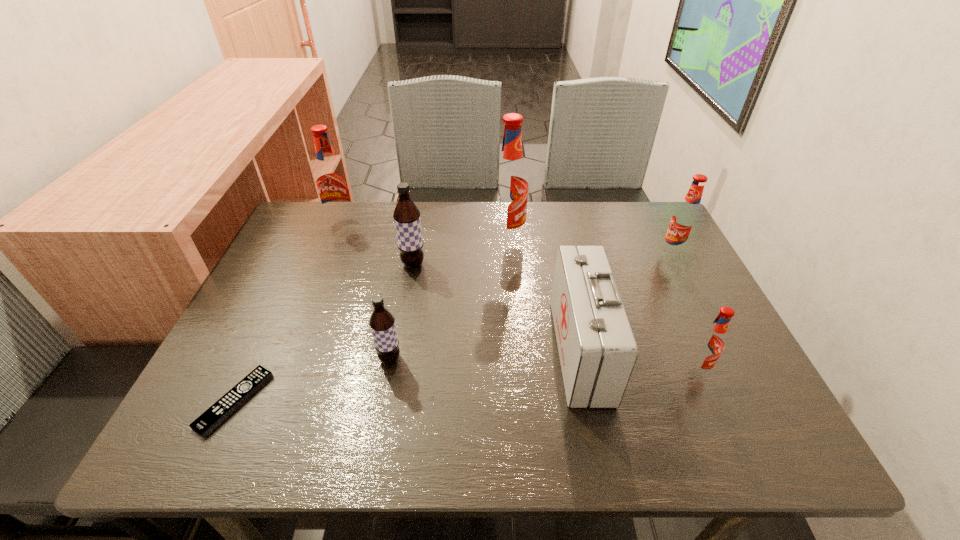
Identify the location of free point at the far edge. (540, 219).

This screenshot has height=540, width=960. Find the location of `vacant space at the near edge of the desktop`. vacant space at the near edge of the desktop is located at coordinates (372, 437).

I want to click on free space at the left edge of the desktop, so click(x=214, y=398).

The image size is (960, 540). Identify the location of vacant region at the right edge of the desktop. click(684, 357).

What are the coordinates of `vacant space at the far right corner of the desktop` in the screenshot? It's located at (623, 219).

Where is `free space between the first-aid kit and the rightmost object`? Image resolution: width=960 pixels, height=540 pixels. free space between the first-aid kit and the rightmost object is located at coordinates (627, 302).

Find the location of a particular element. The height and width of the screenshot is (540, 960). vacant area between the second smallest red root beer and the nearest red root beer is located at coordinates (684, 312).

Identify the location of blank region between the first-aid kit and the leftmost root beer. This screenshot has width=960, height=540. (461, 287).

Identify the location of free spot between the leftmost root beer and the fifth root beer from left to right. coord(519,297).

I want to click on free space between the third red root beer from left to right and the nearer brown root beer, so click(x=543, y=364).